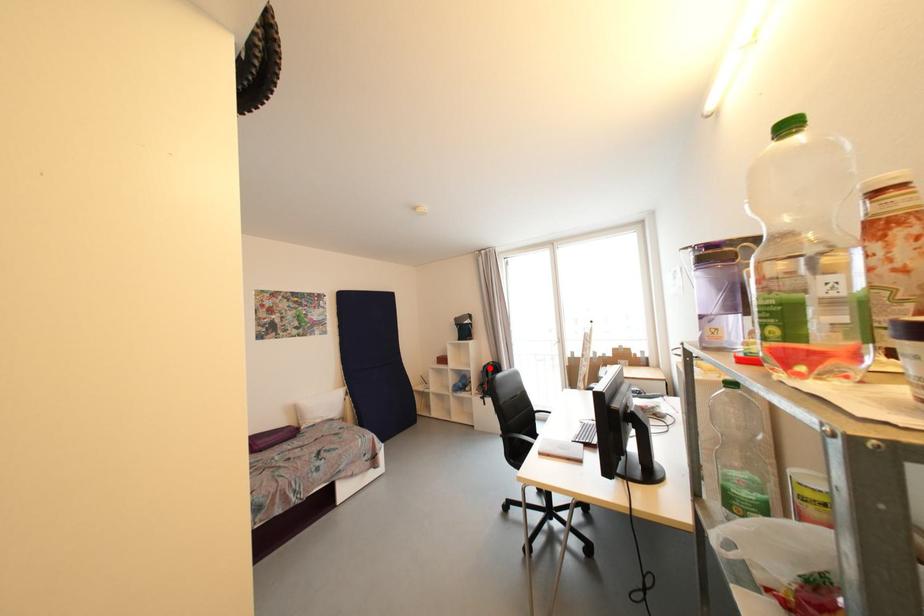
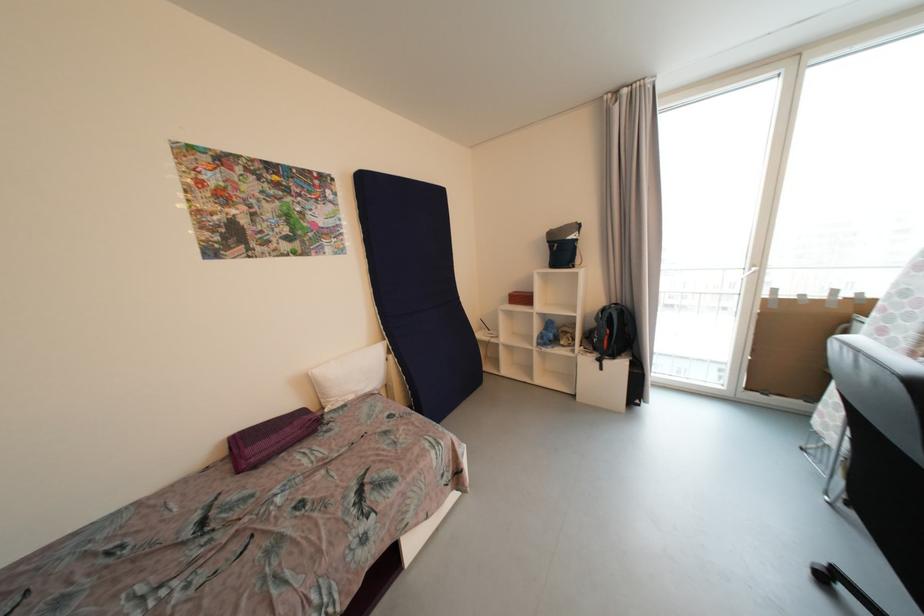
Question: I am providing you with two images of the same scene from different viewpoints. A red point is marked on the first image. Is the red point's position out of view in image 2?

Choices:
 (A) Yes
 (B) No

Answer: (B)